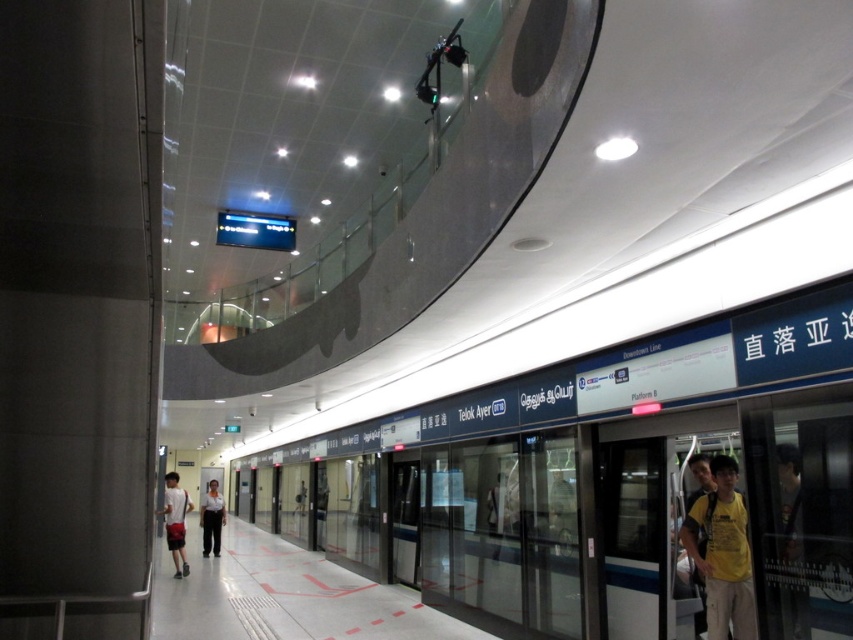
Who is positioned more to the left, white cotton t-shirt at lower left or white fabric shirt at center?

Positioned to the left is white fabric shirt at center.

Which is below, white cotton t-shirt at lower left or white fabric shirt at center?

white fabric shirt at center

Is point (183, 557) closer to camera compared to point (218, 531)?

That is True.

The height and width of the screenshot is (640, 853). Identify the location of white cotton t-shirt at lower left. (175, 522).

Looking at this image, who is positioned more to the right, yellow t-shirt at right or white cotton t-shirt at lower left?

Positioned to the right is yellow t-shirt at right.

Who is lower down, yellow t-shirt at right or white cotton t-shirt at lower left?

white cotton t-shirt at lower left is lower down.

Image resolution: width=853 pixels, height=640 pixels. Find the location of `yellow t-shirt at right`. yellow t-shirt at right is located at coordinates (722, 554).

Can you confirm if yellow t-shirt at right is wider than white fabric shirt at center?

In fact, yellow t-shirt at right might be narrower than white fabric shirt at center.

Between yellow t-shirt at right and white fabric shirt at center, which one has more height?

white fabric shirt at center is taller.

Locate an element on the screen. This screenshot has height=640, width=853. yellow t-shirt at right is located at coordinates (722, 554).